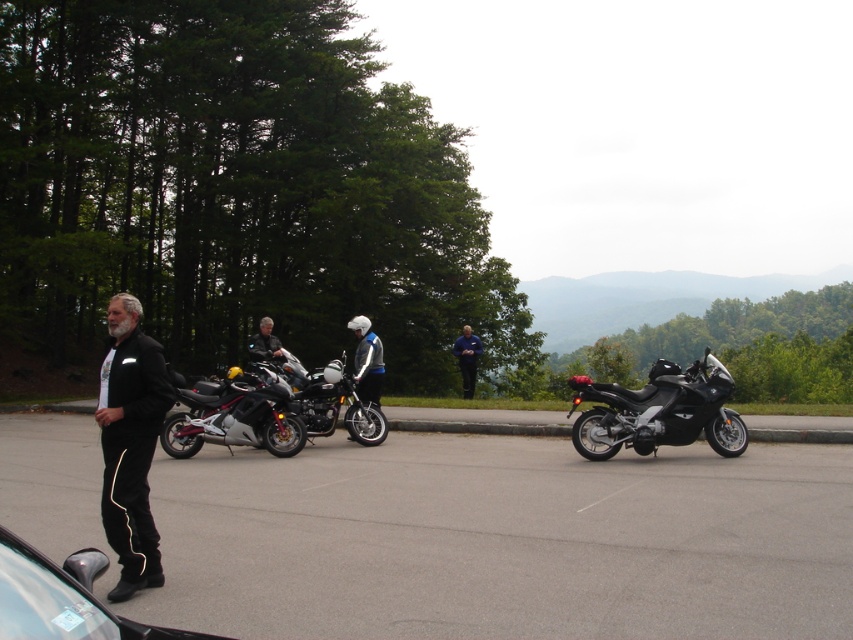
You are a photographer setting up a tripod to capture the black glossy car at lower left and the shiny metallic motorcycle at center. Based on their positions, which object is positioned to the right of the other?

The black glossy car at lower left is positioned to the right of the shiny metallic motorcycle at center.